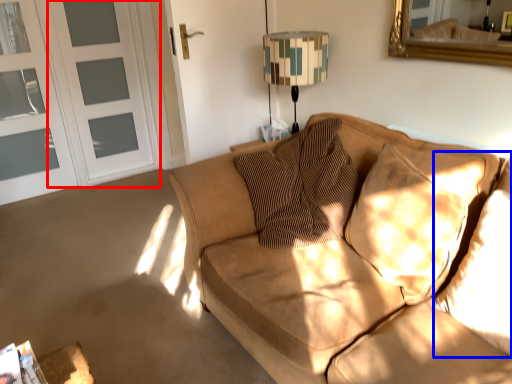
Question: Which of the following is the closest to the observer, screen door (highlighted by a red box) or pillow (highlighted by a blue box)?

Choices:
 (A) screen door
 (B) pillow

Answer: (B)